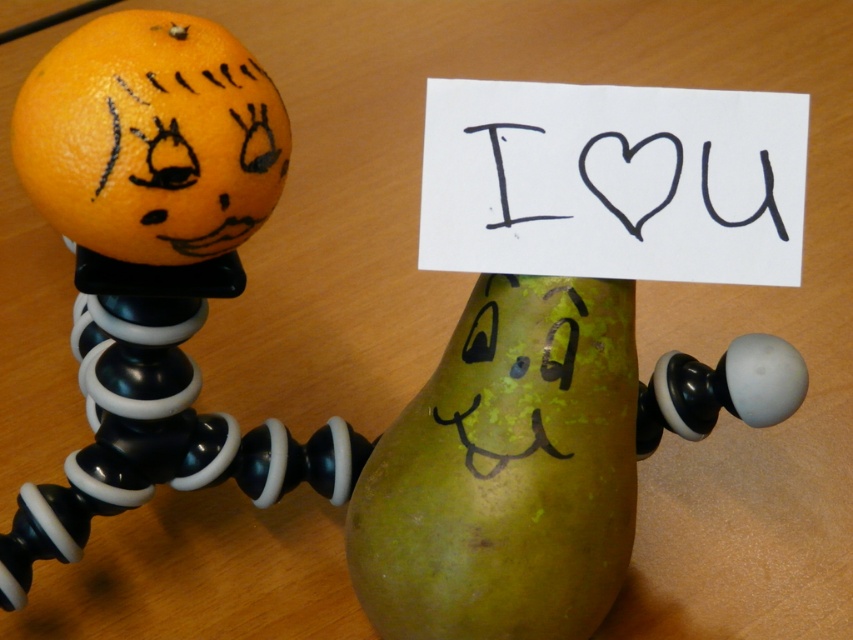
Is green matte pear at center further to the viewer compared to orangesmoothfruit at left?

That is True.

Does green matte pear at center appear on the left side of orangesmoothfruit at left?

Incorrect, green matte pear at center is not on the left side of orangesmoothfruit at left.

Which is in front, point (585, 285) or point (138, 195)?

Point (138, 195) is more forward.

I want to click on green matte pear at center, so click(506, 472).

Is point (581, 284) closer to viewer compared to point (570, 216)?

No, (581, 284) is further to viewer.

Does green matte pear at center appear on the right side of black paper at center?

In fact, green matte pear at center is to the left of black paper at center.

Locate an element on the screen. Image resolution: width=853 pixels, height=640 pixels. green matte pear at center is located at coordinates (506, 472).

Consider the image. Who is lower down, orangesmoothfruit at left or black paper at center?

black paper at center is lower down.

Can you confirm if orangesmoothfruit at left is shorter than black paper at center?

No, orangesmoothfruit at left is not shorter than black paper at center.

Which is in front, point (41, 198) or point (633, 145)?

Point (41, 198) is in front.

Find the location of `orangesmoothfruit at left`. orangesmoothfruit at left is located at coordinates (151, 138).